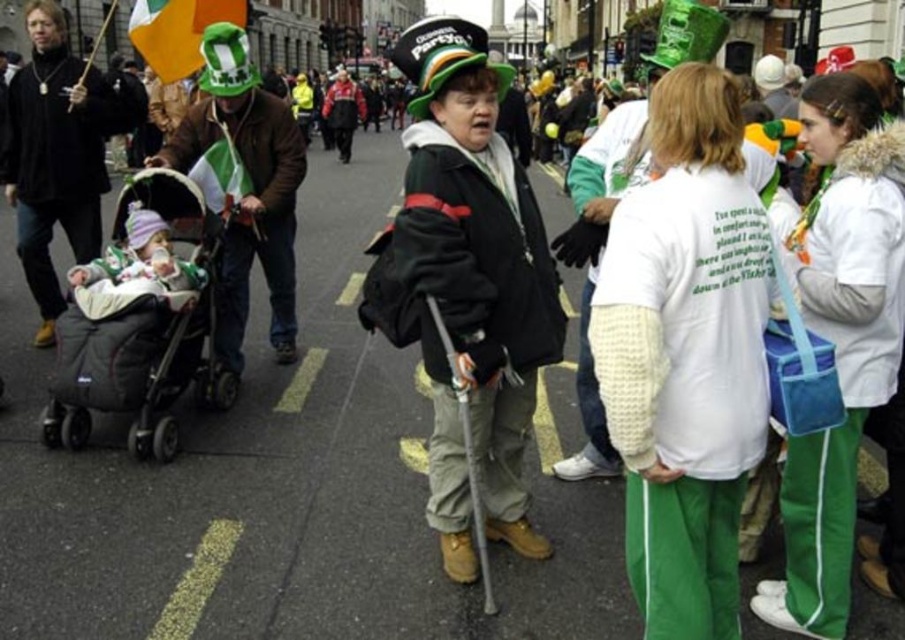
You are a photographer trying to capture both the matte black jacket at center and the shiny green hat at left in a single frame. Which object should you adjust your camera angle to focus on first to ensure both are in the frame?

The matte black jacket at center is taller than the shiny green hat at left, so you should focus on the matte black jacket at center first to ensure it fits within the frame, and then adjust to include the shorter shiny green hat at left.

You are a photographer standing in the middle of the street during the parade. You want to capture a photo of the woman in the black jacket with the hat that says Parrot. However, there are two obstacles blocking your view. The gray fabric stroller at left and the soft green fabric baby carriage at left are in the way. Which obstacle is closer to you that you need to move first?

The gray fabric stroller at left is located below the soft green fabric baby carriage at left, meaning it is closer to you. Therefore, you should move the gray fabric stroller at left first to get a clear view of the woman.